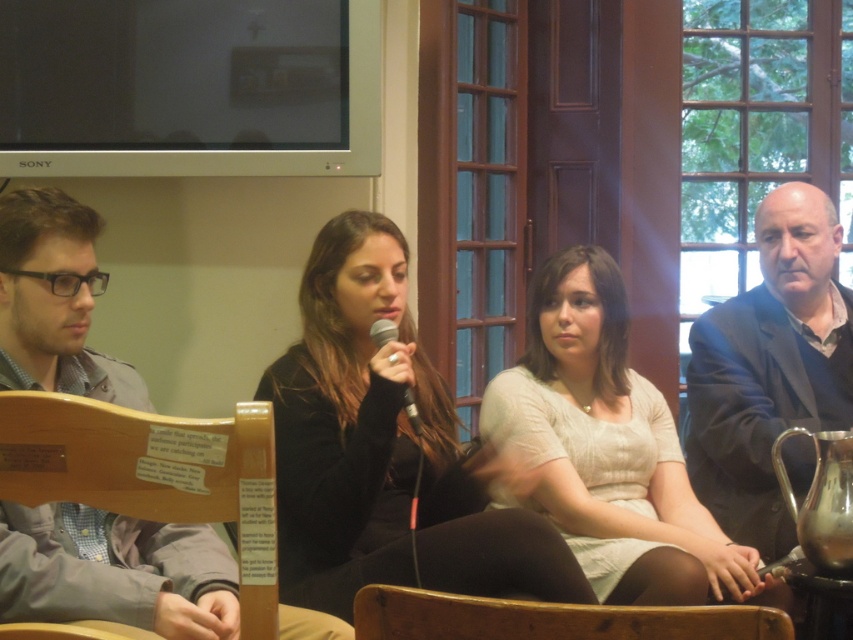
Question: Does light beige knit sweater at center have a smaller size compared to dark blue suit at right?

Choices:
 (A) no
 (B) yes

Answer: (A)

Question: Observing the image, what is the correct spatial positioning of dark blue suit at right in reference to wooden chair at lower left?

Choices:
 (A) below
 (B) above

Answer: (B)

Question: Considering the real-world distances, which object is closest to the wooden chair at lower center?

Choices:
 (A) black velvet jacket at center
 (B) wooden chair at lower left
 (C) black metallic microphone at center
 (D) light beige knit sweater at center

Answer: (B)

Question: Estimate the real-world distances between objects in this image. Which object is closer to the wooden chair at lower center?

Choices:
 (A) gray fabric jacket at left
 (B) black metallic microphone at center
 (C) light beige knit sweater at center
 (D) black velvet jacket at center

Answer: (A)

Question: Which of the following is the farthest from the observer?

Choices:
 (A) (732, 323)
 (B) (398, 618)

Answer: (A)

Question: Does light beige knit sweater at center appear over gray fabric jacket at left?

Choices:
 (A) no
 (B) yes

Answer: (B)